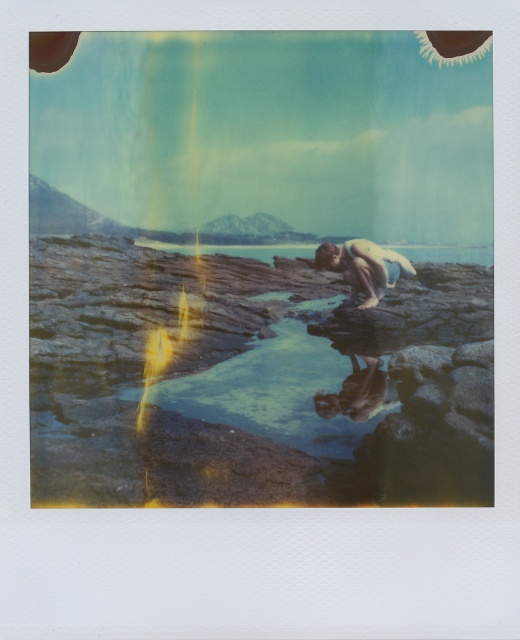
Question: Which point is farther from the camera taking this photo?

Choices:
 (A) (370, 360)
 (B) (365, 276)

Answer: (B)

Question: Is smooth skin person at center bigger than smooth stone water at center?

Choices:
 (A) yes
 (B) no

Answer: (A)

Question: Among these points, which one is farthest from the camera?

Choices:
 (A) (344, 248)
 (B) (317, 401)

Answer: (A)

Question: Is smooth skin person at center wider than smooth stone water at center?

Choices:
 (A) no
 (B) yes

Answer: (B)

Question: Does smooth skin person at center have a smaller size compared to smooth stone water at center?

Choices:
 (A) no
 (B) yes

Answer: (A)